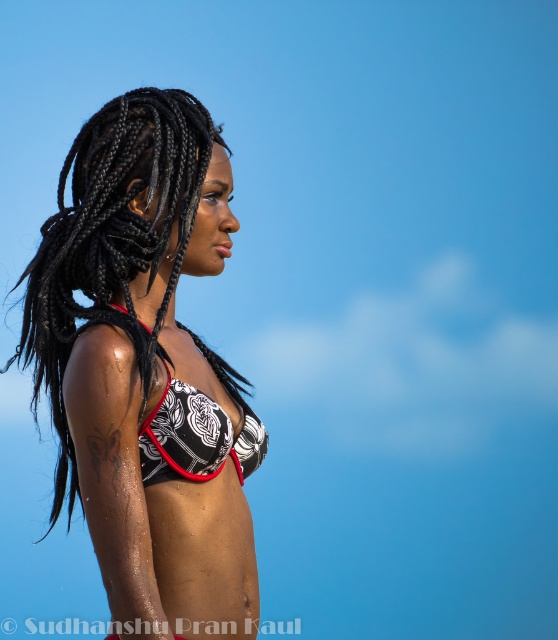
You are a fashion designer analyzing a photo of a person wearing swimwear. You need to determine which bikini top is taller between the printed fabric bikini top at center and the black printed bikini top at center. Which one is taller?

The printed fabric bikini top at center is much taller than the black printed bikini top at center according to the description.

You are a fashion designer analyzing the image of a person wearing swimwear. You need to determine the placement of the printed fabric bikini top at center and the black printed bikini top at center. Which one is positioned higher on the body?

The printed fabric bikini top at center is located above the black printed bikini top at center, meaning it is positioned higher on the body.